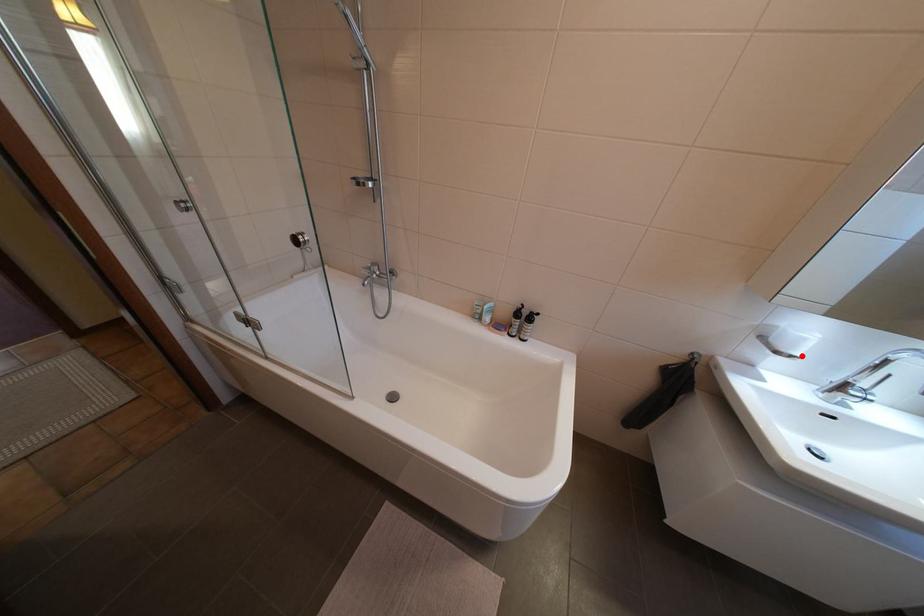
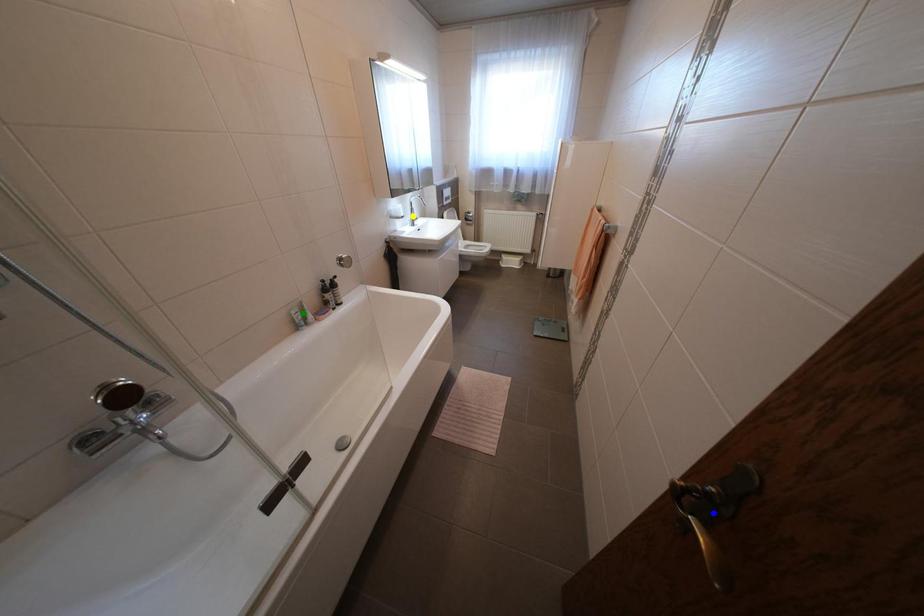
Question: I am providing you with two images of the same scene from different viewpoints. A red point is marked on the first image. You are given multiple points on the second image. Which point in image 2 is actually the same real-world point as the red point in image 1?

Choices:
 (A) yellow point
 (B) blue point
 (C) green point

Answer: (A)